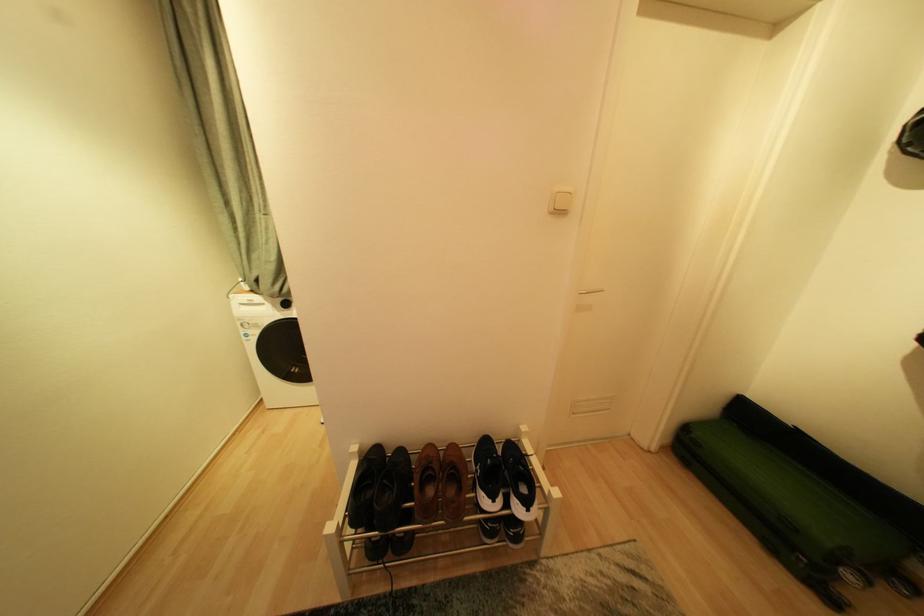
Locate an element on the screen. The width and height of the screenshot is (924, 616). white door handle is located at coordinates (588, 297).